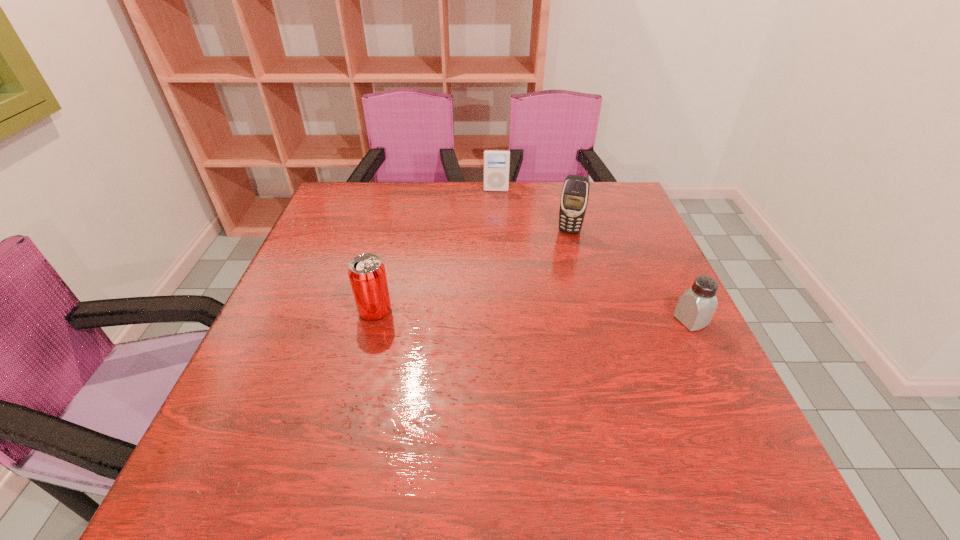
Where is `free space located on the front face of the second object from right to left`? This screenshot has height=540, width=960. free space located on the front face of the second object from right to left is located at coordinates (558, 269).

At what (x,y) coordinates should I click in order to perform the action: click on blank area located 0.070m on the front face of the second object from right to left. Please return your answer as a coordinate pair (x, y). The width and height of the screenshot is (960, 540). Looking at the image, I should click on (563, 251).

Identify the location of vacant space located 0.310m on the front-facing side of the farthest object. This screenshot has width=960, height=540. (494, 252).

This screenshot has width=960, height=540. What are the coordinates of `vacant point located on the front-facing side of the farthest object` in the screenshot? It's located at (494, 252).

Find the location of `free space located on the front-facing side of the farthest object`. free space located on the front-facing side of the farthest object is located at coordinates (494, 269).

What are the coordinates of `object at the far edge` in the screenshot? It's located at (496, 162).

Find the location of a particular element. object situated at the right edge is located at coordinates (696, 306).

Identify the location of free space at the far edge. (436, 214).

Where is `blank space at the near edge of the desktop`? blank space at the near edge of the desktop is located at coordinates (403, 399).

Where is `free space at the left edge`? This screenshot has width=960, height=540. free space at the left edge is located at coordinates (349, 258).